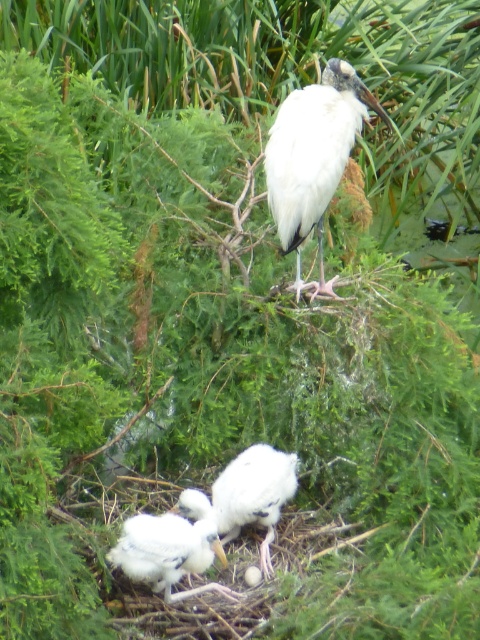
You are a nature photographer observing the scene. You need to capture a photo where both the white smooth stork at center and the white fluffy bird at center are visible. Which of the two birds is wider and might require adjusting your camera angle to ensure both fit in the frame?

The white smooth stork at center is wider than the white fluffy bird at center, so you may need to adjust your camera angle to accommodate its greater width for both to fit in the frame.

You are a nature photographer standing in a blind 3 meters away from the white smooth stork at center. Can you get a clear photo without moving closer?

The white smooth stork at center is 2.69 meters from viewer. Since you are 3 meters away, you are slightly farther than the stork, so you can still get a clear photo without moving closer.

In the serene natural scene, there are two birds in the nest at the center. The adult bird is a white smooth stork at center, and the other is a white fluffy bird at center. Which one is taller?

The white smooth stork at center is much taller than the white fluffy bird at center.